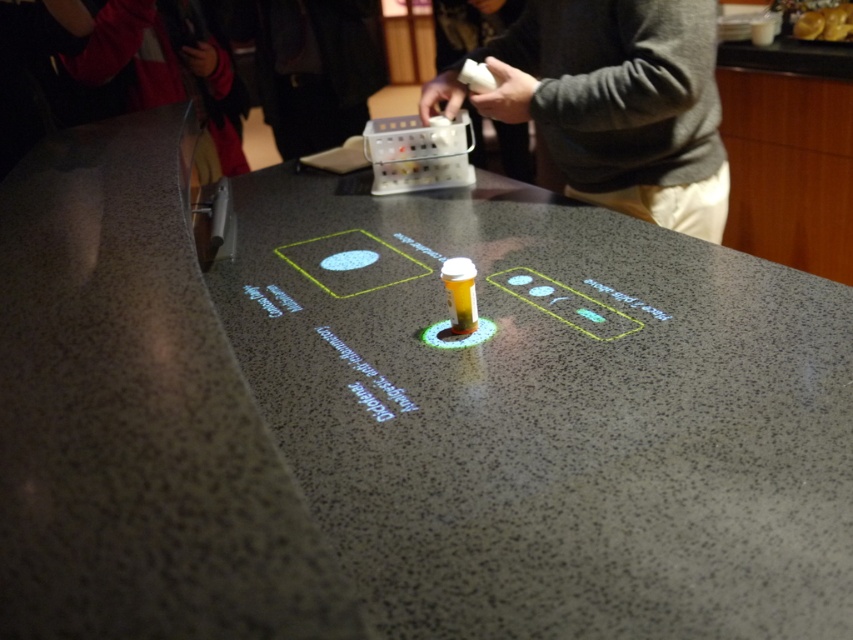
You are a delivery person who just arrived at a high tech lab. You see a gray sweater at upper center. Where should you place it?

You should place the gray sweater at upper center at point (619, 104).

Consider the image. You are a technician working on a virtual interface projected onto a speckled granite counter. The interface has a point labeled as point (547, 412). Where is this point located in relation to the center of the counter?

The point (547, 412) is located at the center of the speckled granite counter.

You are organizing a virtual wardrobe and see the gray sweater at upper center and the red jacket at upper left in the projection. Which item is positioned more to the right side of the virtual interface?

The gray sweater at upper center is positioned more to the right side of the virtual interface than the red jacket at upper left.